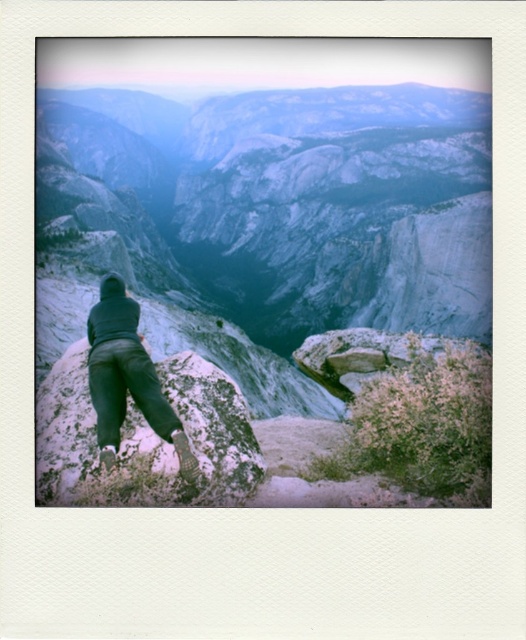
You are a hiker trying to cross a narrow path between two rocks. The path is between the smooth granite rock at center and the white textured rock at center. If your backpack is 1 meter wide, can you pass through the path?

The smooth granite rock at center is wider than the white textured rock at center, but the description does not provide the exact width of the path. Therefore, it is uncertain whether the backpack can pass through.

Consider the image. You are a hiker trying to climb the smooth granite rock at center. Your dark gray pants at center are 1 meter in length. Can you determine if the rock is wider than your pants?

The smooth granite rock at center might be wider than dark gray pants at center, so it is possible the rock is wider than the pants.